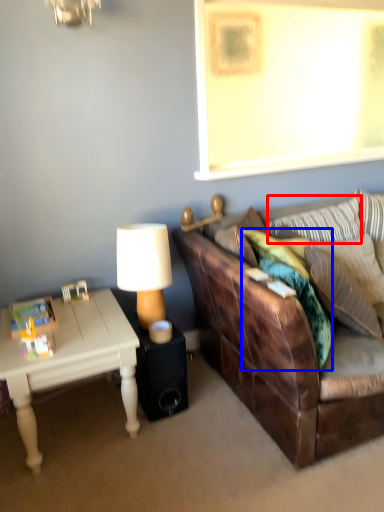
Question: Which object appears closest to the camera in this image, pillow (highlighted by a red box) or pillow (highlighted by a blue box)?

Choices:
 (A) pillow
 (B) pillow

Answer: (B)